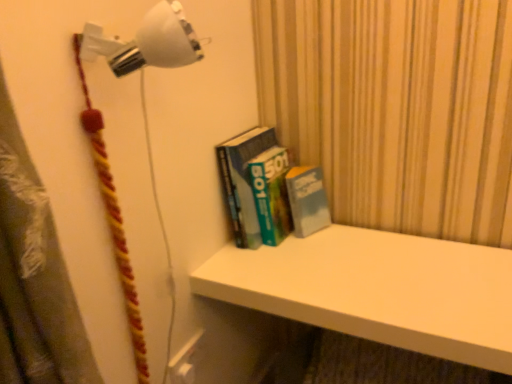
Question: Is white plastic lamp at upper left, which is counted as the first lamp, starting from the bottom, with white matte shelf at upper center?

Choices:
 (A) no
 (B) yes

Answer: (A)

Question: Is white plastic lamp at upper left, which is counted as the first lamp, starting from the bottom, facing away from white matte shelf at upper center?

Choices:
 (A) yes
 (B) no

Answer: (B)

Question: From the image's perspective, does white plastic lamp at upper left, which ranks as the 2th lamp in top-to-bottom order, appear lower than white matte shelf at upper center?

Choices:
 (A) no
 (B) yes

Answer: (A)

Question: Is white plastic lamp at upper left, which is counted as the first lamp, starting from the bottom, further to camera compared to white matte shelf at upper center?

Choices:
 (A) no
 (B) yes

Answer: (A)

Question: From the image's perspective, is white plastic lamp at upper left, which is counted as the first lamp, starting from the bottom, on white matte shelf at upper center?

Choices:
 (A) yes
 (B) no

Answer: (A)

Question: Relative to white matte shelf at upper center, is hardcover books at center in front or behind?

Choices:
 (A) front
 (B) behind

Answer: (B)

Question: In terms of size, does hardcover books at center appear bigger or smaller than white matte shelf at upper center?

Choices:
 (A) big
 (B) small

Answer: (B)

Question: Does point 285,216 appear closer or farther from the camera than point 268,269?

Choices:
 (A) farther
 (B) closer

Answer: (A)

Question: From a real-world perspective, is hardcover books at center positioned above or below white matte shelf at upper center?

Choices:
 (A) above
 (B) below

Answer: (A)

Question: Considering the positions of point (110, 41) and point (278, 225), is point (110, 41) closer or farther from the camera than point (278, 225)?

Choices:
 (A) closer
 (B) farther

Answer: (A)

Question: From the image's perspective, relative to hardcover books at center, is white plastic wall lamp at upper left, the 2th lamp in the bottom-to-top sequence, above or below?

Choices:
 (A) below
 (B) above

Answer: (B)

Question: In terms of height, does white plastic wall lamp at upper left, which is counted as the first lamp, starting from the top, look taller or shorter compared to hardcover books at center?

Choices:
 (A) short
 (B) tall

Answer: (A)

Question: Is white plastic wall lamp at upper left, which is counted as the first lamp, starting from the top, to the left or to the right of hardcover books at center in the image?

Choices:
 (A) left
 (B) right

Answer: (A)

Question: Considering the positions of white plastic wall lamp at upper left, which is counted as the first lamp, starting from the top, and white matte shelf at upper center in the image, is white plastic wall lamp at upper left, which is counted as the first lamp, starting from the top, taller or shorter than white matte shelf at upper center?

Choices:
 (A) tall
 (B) short

Answer: (B)

Question: Which is correct: white plastic wall lamp at upper left, the 2th lamp in the bottom-to-top sequence, is inside white matte shelf at upper center, or outside of it?

Choices:
 (A) inside
 (B) outside

Answer: (B)